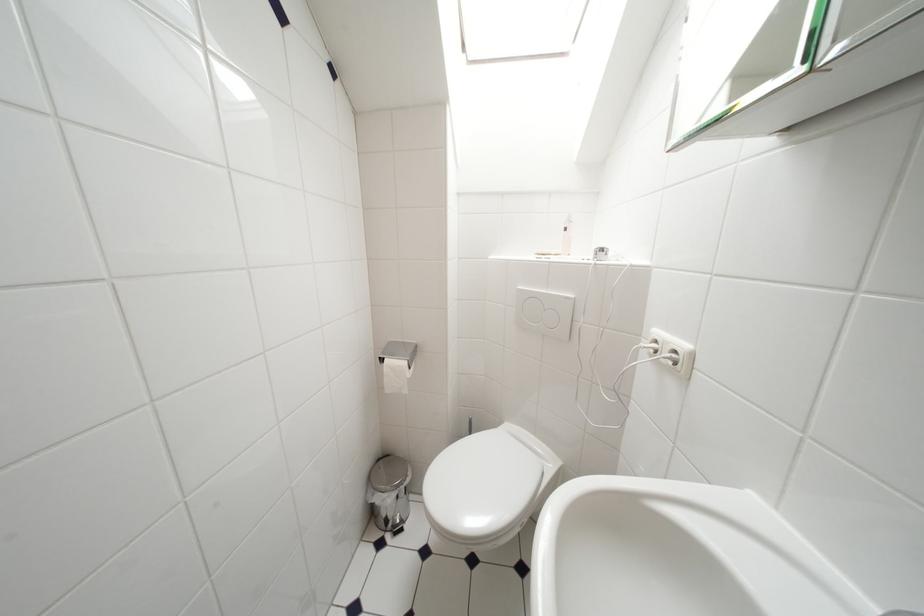
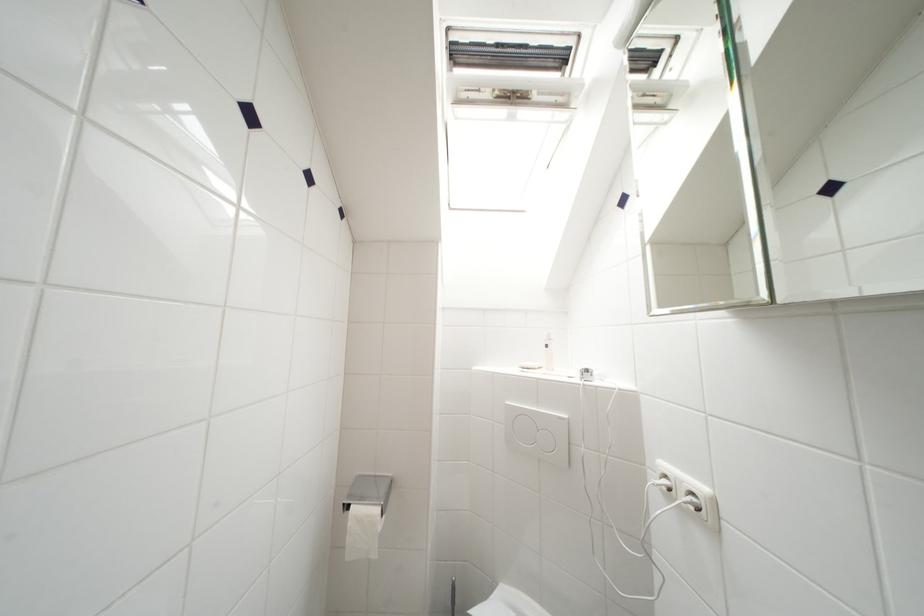
Find the pixel in the second image that matches pixel 682 355 in the first image.

(699, 498)